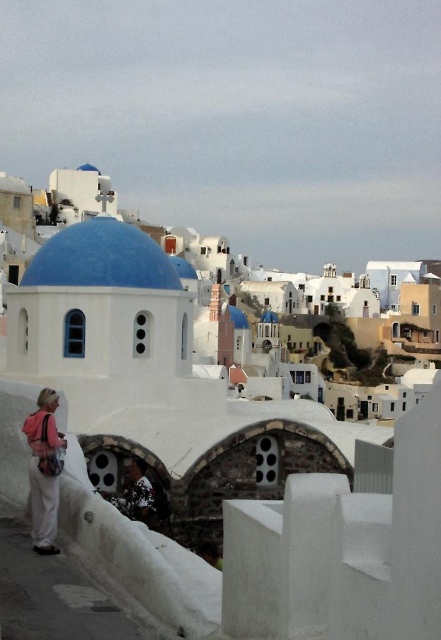
You are a tourist in Santorini and want to take a photo of the blue glossy dome at center and the pink fabric at lower left. Which object should you focus on first if you want to include both in your shot without moving the camera?

The blue glossy dome at center is bigger than the pink fabric at lower left, so you should focus on the blue glossy dome at center first to ensure it fits properly in the frame before adjusting for the smaller pink fabric at lower left.

In the scene shown: You are a tourist standing in the narrow street of the Greek village. You want to take a photo of the blue glossy dome at center. Where should you position yourself to capture it in the frame?

To capture the blue glossy dome at center in your photo, position yourself at point (100, 259) where the dome is located.